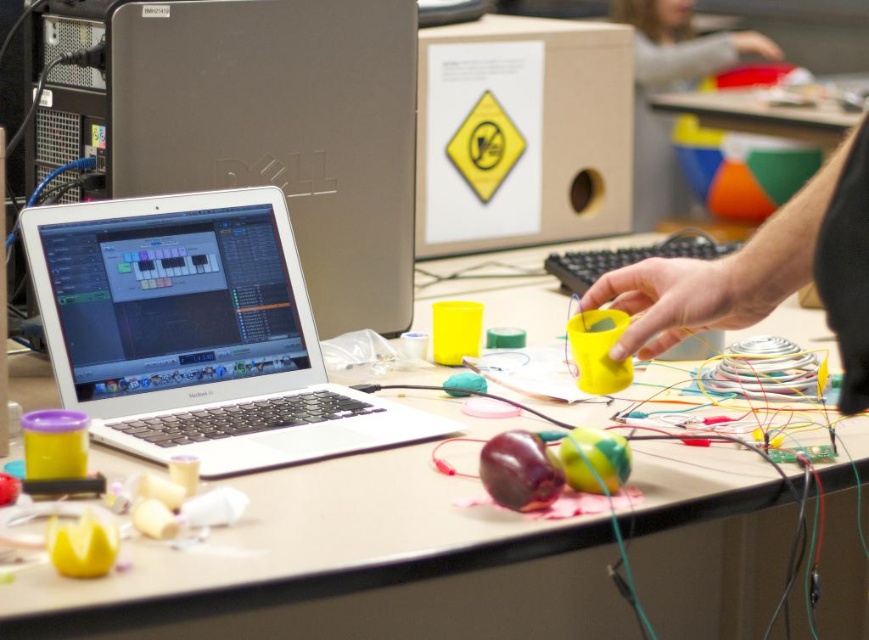
Who is positioned more to the left, smooth plastic ball at upper right or shiny purple plastic toy at center?

Positioned to the left is shiny purple plastic toy at center.

Between point (693, 51) and point (485, 452), which one is positioned in front?

Point (485, 452) is in front.

Locate an element on the screen. The image size is (869, 640). smooth plastic ball at upper right is located at coordinates (671, 90).

Locate an element on the screen. matte plastic table at center is located at coordinates (299, 548).

Does matte plastic table at center appear on the right side of yellow matte cup at center?

No, matte plastic table at center is not to the right of yellow matte cup at center.

The width and height of the screenshot is (869, 640). Identify the location of matte plastic table at center. (299, 548).

Is the position of yellow matte cup at center less distant than that of rubberized green ball at center?

No, yellow matte cup at center is behind rubberized green ball at center.

Where is `yellow matte cup at center`? Image resolution: width=869 pixels, height=640 pixels. yellow matte cup at center is located at coordinates (596, 349).